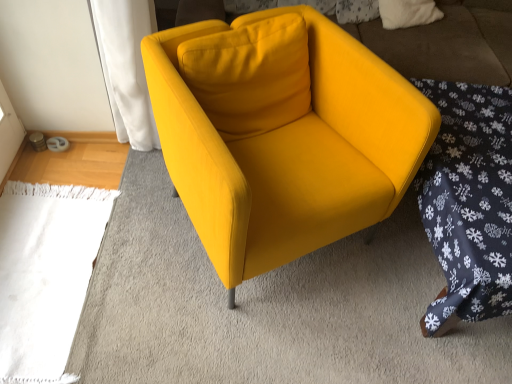
Describe the element at coordinates (290, 150) in the screenshot. The height and width of the screenshot is (384, 512). I see `matte yellow armchair at center` at that location.

At what (x,y) coordinates should I click in order to perform the action: click on matte yellow armchair at center. Please return your answer as a coordinate pair (x, y). Image resolution: width=512 pixels, height=384 pixels. Looking at the image, I should click on (290, 150).

Locate an element on the screen. dark blue snowflake-patterned fabric at lower right is located at coordinates click(x=468, y=202).

Describe the element at coordinates (468, 202) in the screenshot. I see `dark blue snowflake-patterned fabric at lower right` at that location.

At what (x,y) coordinates should I click in order to perform the action: click on matte yellow armchair at center. Please return your answer as a coordinate pair (x, y). This screenshot has width=512, height=384. Looking at the image, I should click on (290, 150).

Would you say dark blue snowflake-patterned fabric at lower right is to the left or to the right of matte yellow armchair at center in the picture?

Clearly, dark blue snowflake-patterned fabric at lower right is on the right of matte yellow armchair at center in the image.

Which object is more forward, dark blue snowflake-patterned fabric at lower right or matte yellow armchair at center?

→ Positioned in front is matte yellow armchair at center.

Which is behind, point (446, 92) or point (340, 200)?

The point (446, 92) is farther.

From the image's perspective, is dark blue snowflake-patterned fabric at lower right above matte yellow armchair at center?

Actually, dark blue snowflake-patterned fabric at lower right appears below matte yellow armchair at center in the image.

From a real-world perspective, is dark blue snowflake-patterned fabric at lower right on matte yellow armchair at center?

No, from a real-world perspective, dark blue snowflake-patterned fabric at lower right is not over matte yellow armchair at center

Which object is thinner, dark blue snowflake-patterned fabric at lower right or matte yellow armchair at center?

Thinner between the two is matte yellow armchair at center.

Is dark blue snowflake-patterned fabric at lower right shorter than matte yellow armchair at center?

Indeed, dark blue snowflake-patterned fabric at lower right has a lesser height compared to matte yellow armchair at center.

In terms of size, does dark blue snowflake-patterned fabric at lower right appear bigger or smaller than matte yellow armchair at center?

Considering their sizes, dark blue snowflake-patterned fabric at lower right takes up less space than matte yellow armchair at center.

Is dark blue snowflake-patterned fabric at lower right situated inside matte yellow armchair at center or outside?

The correct answer is: outside.

Is dark blue snowflake-patterned fabric at lower right next to matte yellow armchair at center?

No, dark blue snowflake-patterned fabric at lower right is not beside matte yellow armchair at center.

Could you tell me if dark blue snowflake-patterned fabric at lower right is turned towards matte yellow armchair at center?

No, dark blue snowflake-patterned fabric at lower right is not oriented towards matte yellow armchair at center.

What's the angular difference between dark blue snowflake-patterned fabric at lower right and matte yellow armchair at center's facing directions?

There is a 29.1-degree angle between the facing directions of dark blue snowflake-patterned fabric at lower right and matte yellow armchair at center.

I want to click on bedding on the right of the matte yellow armchair at center, so click(x=468, y=202).

Does matte yellow armchair at center appear on the right side of dark blue snowflake-patterned fabric at lower right?

Incorrect, matte yellow armchair at center is not on the right side of dark blue snowflake-patterned fabric at lower right.

Which is in front, matte yellow armchair at center or dark blue snowflake-patterned fabric at lower right?

matte yellow armchair at center is in front.

Considering the positions of points (328, 52) and (431, 324), is point (328, 52) farther from camera compared to point (431, 324)?

Yes, point (328, 52) is farther from viewer.

From the image's perspective, is matte yellow armchair at center below dark blue snowflake-patterned fabric at lower right?

No.

From a real-world perspective, who is located higher, matte yellow armchair at center or dark blue snowflake-patterned fabric at lower right?

matte yellow armchair at center is physically above.

Which object is wider, matte yellow armchair at center or dark blue snowflake-patterned fabric at lower right?

dark blue snowflake-patterned fabric at lower right.

Who is taller, matte yellow armchair at center or dark blue snowflake-patterned fabric at lower right?

Standing taller between the two is matte yellow armchair at center.

Considering the relative sizes of matte yellow armchair at center and dark blue snowflake-patterned fabric at lower right in the image provided, is matte yellow armchair at center smaller than dark blue snowflake-patterned fabric at lower right?

No.

Would you say matte yellow armchair at center is outside dark blue snowflake-patterned fabric at lower right?

matte yellow armchair at center is positioned outside dark blue snowflake-patterned fabric at lower right.

Is matte yellow armchair at center far away from dark blue snowflake-patterned fabric at lower right?

No, matte yellow armchair at center is not far away from dark blue snowflake-patterned fabric at lower right.

Is matte yellow armchair at center facing towards dark blue snowflake-patterned fabric at lower right?

No, matte yellow armchair at center is not turned towards dark blue snowflake-patterned fabric at lower right.

How different are the orientations of matte yellow armchair at center and dark blue snowflake-patterned fabric at lower right in degrees?

matte yellow armchair at center and dark blue snowflake-patterned fabric at lower right are facing 29.1 degrees away from each other.

Locate an element on the screen. bedding that appears behind the matte yellow armchair at center is located at coordinates (468, 202).

At what (x,y) coordinates should I click in order to perform the action: click on chair in front of the dark blue snowflake-patterned fabric at lower right. Please return your answer as a coordinate pair (x, y). This screenshot has width=512, height=384. Looking at the image, I should click on (290, 150).

Find the location of a particular element. This screenshot has height=384, width=512. bedding that appears behind the matte yellow armchair at center is located at coordinates (468, 202).